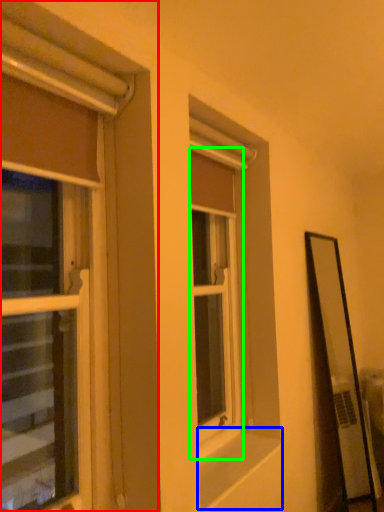
Question: Based on their relative distances, which object is nearer to window (highlighted by a red box)? Choose from window sill (highlighted by a blue box) and window (highlighted by a green box).

Choices:
 (A) window sill
 (B) window

Answer: (A)